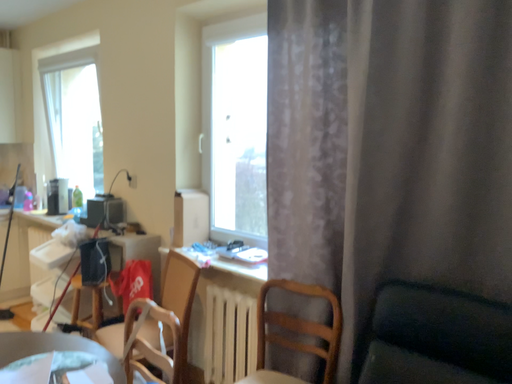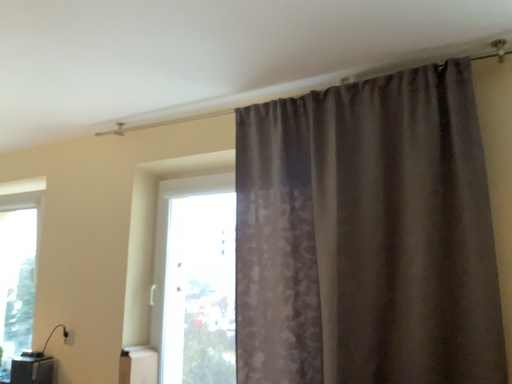
Question: Which way did the camera rotate in the video?

Choices:
 (A) rotated upward
 (B) rotated downward

Answer: (A)